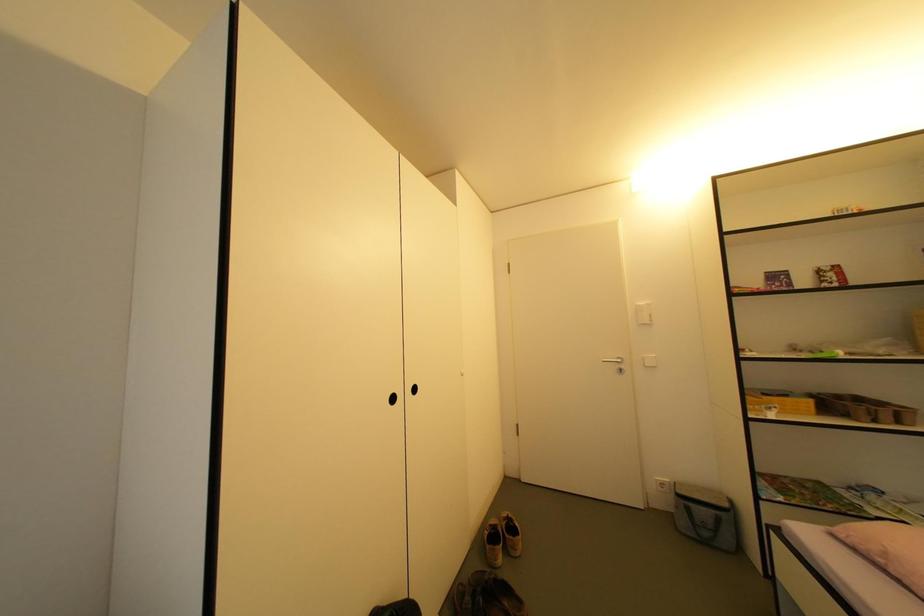
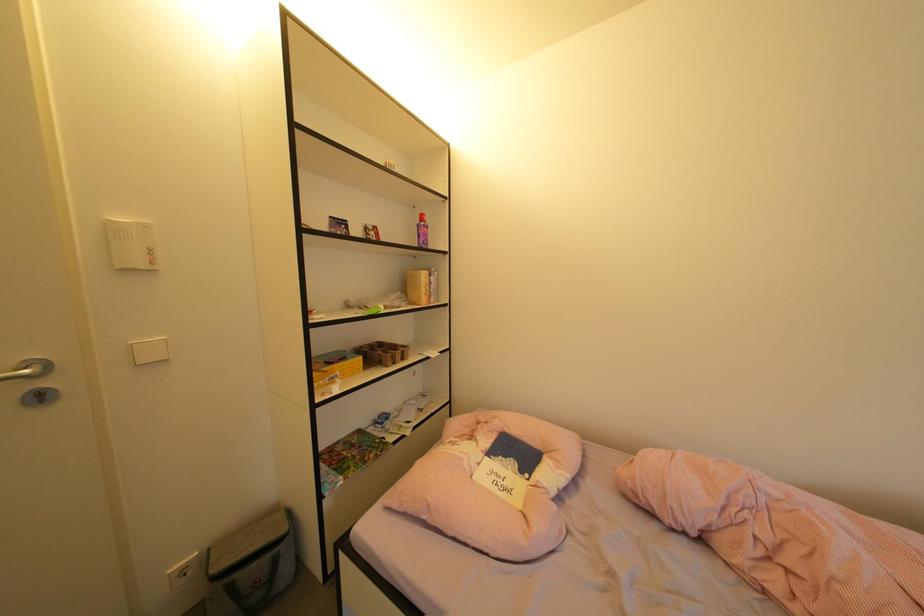
Question: How did the camera likely rotate?

Choices:
 (A) Left
 (B) Right
 (C) Up
 (D) Down

Answer: (B)